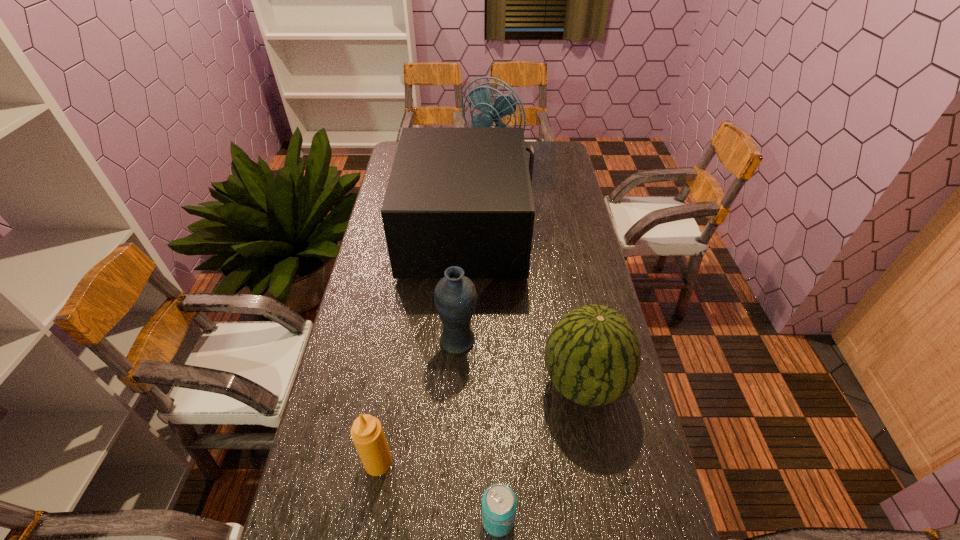
This screenshot has height=540, width=960. I want to click on free spot located on the front-facing side of the microwave oven, so click(561, 233).

This screenshot has width=960, height=540. I want to click on free location located 0.290m on the back of the vase, so click(462, 262).

What are the coordinates of `free space located on the left of the watermelon` in the screenshot? It's located at (487, 383).

Locate an element on the screen. vacant area situated on the right of the fifth farthest object is located at coordinates (516, 462).

You are a GUI agent. You are given a task and a screenshot of the screen. Output one action in this format:
    pyautogui.click(x=<x>, y=<y>)
    Task: Click on the blank space located 0.340m on the back of the shortest object
    The height and width of the screenshot is (540, 960).
    Given the screenshot: What is the action you would take?
    pyautogui.click(x=494, y=373)

This screenshot has width=960, height=540. I want to click on object positioned at the far edge, so click(480, 97).

Locate an element on the screen. Image resolution: width=960 pixels, height=540 pixels. microwave oven at the left edge is located at coordinates (462, 197).

The width and height of the screenshot is (960, 540). In order to click on condiment that is at the left edge in this screenshot , I will do `click(367, 433)`.

Where is `object that is at the right edge`? The height and width of the screenshot is (540, 960). object that is at the right edge is located at coordinates (592, 355).

This screenshot has width=960, height=540. Identify the location of vacant space at the left edge of the desktop. (312, 524).